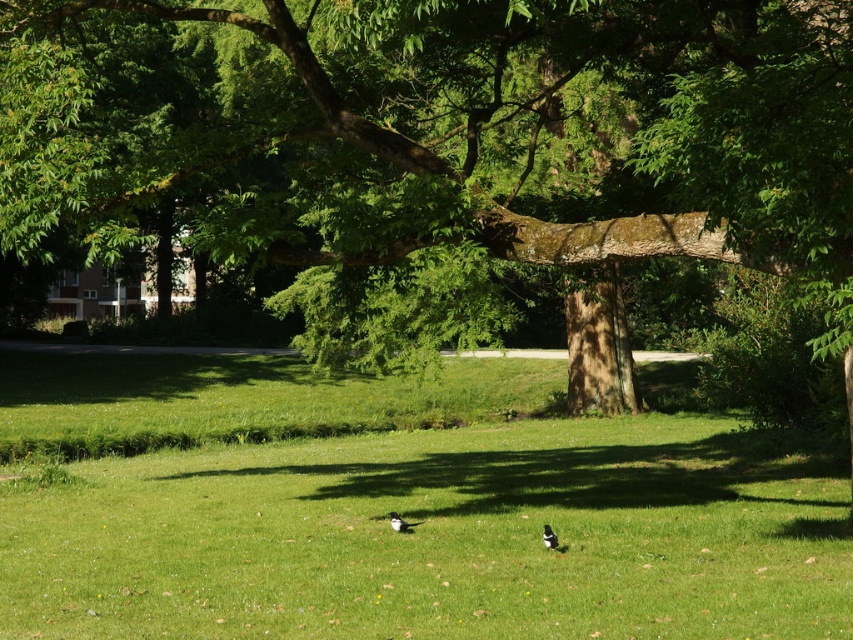
Who is positioned more to the left, green leafy tree at center or white glossy bird at center?

green leafy tree at center

Between point (724, 141) and point (416, 522), which one is positioned in front?

Point (724, 141)

Locate an element on the screen. green leafy tree at center is located at coordinates (445, 140).

Can you confirm if green grassy field at center is shorter than white glossy bird at center?

In fact, green grassy field at center may be taller than white glossy bird at center.

Who is shorter, green grassy field at center or white glossy bird at center?

white glossy bird at center is shorter.

The width and height of the screenshot is (853, 640). What do you see at coordinates (398, 508) in the screenshot?
I see `green grassy field at center` at bounding box center [398, 508].

The image size is (853, 640). I want to click on green grassy field at center, so click(x=398, y=508).

Between green leafy tree at center and green grassy field at center, which one appears on the right side from the viewer's perspective?

Positioned to the right is green grassy field at center.

Is point (666, 100) positioned behind point (91, 522)?

No, it is in front of (91, 522).

Identify the location of green leafy tree at center. (445, 140).

Locate an element on the screen. The width and height of the screenshot is (853, 640). green leafy tree at center is located at coordinates (445, 140).